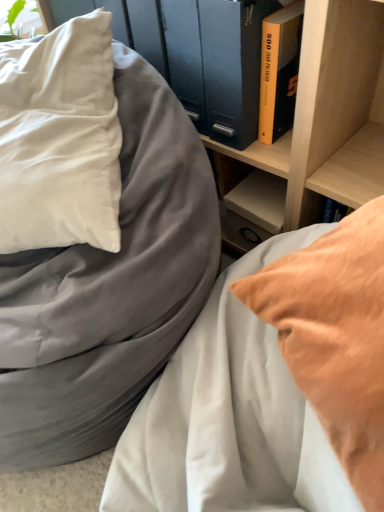
Question: Does yellow hardcover book at upper right appear on the left side of matte gray bed at center, which is the first bed in left-to-right order?

Choices:
 (A) yes
 (B) no

Answer: (B)

Question: From the image's perspective, does yellow hardcover book at upper right appear higher than matte gray bed at center, which is the first bed in left-to-right order?

Choices:
 (A) yes
 (B) no

Answer: (A)

Question: Considering the relative positions of yellow hardcover book at upper right and matte gray bed at center, the 2th bed from the right, in the image provided, is yellow hardcover book at upper right to the right of matte gray bed at center, the 2th bed from the right, from the viewer's perspective?

Choices:
 (A) yes
 (B) no

Answer: (A)

Question: From a real-world perspective, is yellow hardcover book at upper right physically below matte gray bed at center, which is the first bed in left-to-right order?

Choices:
 (A) no
 (B) yes

Answer: (A)

Question: Can you confirm if yellow hardcover book at upper right is smaller than matte gray bed at center, which is the first bed in left-to-right order?

Choices:
 (A) no
 (B) yes

Answer: (B)

Question: From a real-world perspective, is yellow matte book at upper right physically located above or below matte gray bed at center, which is the first bed in left-to-right order?

Choices:
 (A) above
 (B) below

Answer: (A)

Question: Looking at their shapes, would you say yellow matte book at upper right is wider or thinner than matte gray bed at center, which is the first bed in left-to-right order?

Choices:
 (A) wide
 (B) thin

Answer: (B)

Question: In terms of height, does yellow matte book at upper right look taller or shorter compared to matte gray bed at center, the 2th bed from the right?

Choices:
 (A) short
 (B) tall

Answer: (A)

Question: From the image's perspective, is yellow matte book at upper right above or below matte gray bed at center, which is the first bed in left-to-right order?

Choices:
 (A) above
 (B) below

Answer: (A)

Question: From the image's perspective, is wooden shelf at upper center located above or below matte gray bed at center, which is the first bed in left-to-right order?

Choices:
 (A) above
 (B) below

Answer: (A)

Question: Is wooden shelf at upper center inside the boundaries of matte gray bed at center, the 2th bed from the right, or outside?

Choices:
 (A) inside
 (B) outside

Answer: (B)

Question: Considering their positions, is wooden shelf at upper center located in front of or behind matte gray bed at center, the 2th bed from the right?

Choices:
 (A) behind
 (B) front

Answer: (A)

Question: Does point (364, 192) appear closer or farther from the camera than point (11, 81)?

Choices:
 (A) farther
 (B) closer

Answer: (A)

Question: From their relative heights in the image, would you say white satin pillow at left is taller or shorter than matte gray bed at center, acting as the second bed starting from the left?

Choices:
 (A) short
 (B) tall

Answer: (A)

Question: In the image, is white satin pillow at left positioned in front of or behind matte gray bed at center, which is counted as the first bed, starting from the right?

Choices:
 (A) behind
 (B) front

Answer: (A)